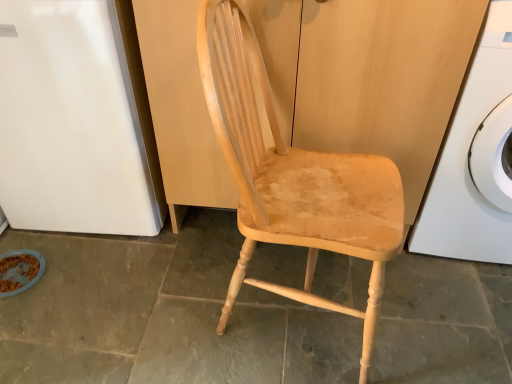
Locate an element on the screen. The width and height of the screenshot is (512, 384). white glossy washing machine at right is located at coordinates (468, 160).

Where is `brown crumbly food at lower left`? This screenshot has height=384, width=512. brown crumbly food at lower left is located at coordinates (17, 271).

What do you see at coordinates (71, 122) in the screenshot?
I see `white glossy refrigerator at left` at bounding box center [71, 122].

At what (x,y) coordinates should I click in order to perform the action: click on white glossy washing machine at right. Please return your answer as a coordinate pair (x, y). Looking at the image, I should click on (468, 160).

Consider the image. Is there a large distance between natural wood dresser at center and natural wood chair at center?

No, natural wood dresser at center is in close proximity to natural wood chair at center.

Considering the positions of objects natural wood dresser at center and natural wood chair at center in the image provided, who is in front, natural wood dresser at center or natural wood chair at center?

natural wood chair at center is closer to the camera.

Considering the relative sizes of natural wood dresser at center and natural wood chair at center in the image provided, is natural wood dresser at center taller than natural wood chair at center?

In fact, natural wood dresser at center may be shorter than natural wood chair at center.

In the scene shown: From the image's perspective, is natural wood dresser at center on natural wood chair at center?

Yes, from the image's perspective, natural wood dresser at center is on top of natural wood chair at center.

Which of these two, brown crumbly food at lower left or white glossy refrigerator at left, is thinner?

With smaller width is brown crumbly food at lower left.

Can you confirm if brown crumbly food at lower left is shorter than white glossy refrigerator at left?

Correct, brown crumbly food at lower left is not as tall as white glossy refrigerator at left.

From the image's perspective, is brown crumbly food at lower left beneath white glossy refrigerator at left?

Yes, from the image's perspective, brown crumbly food at lower left is below white glossy refrigerator at left.

Is brown crumbly food at lower left situated inside white glossy refrigerator at left or outside?

brown crumbly food at lower left is outside white glossy refrigerator at left.

Which is more to the right, white glossy washing machine at right or natural wood dresser at center?

white glossy washing machine at right is more to the right.

Is white glossy washing machine at right oriented towards natural wood dresser at center?

No, white glossy washing machine at right is not oriented towards natural wood dresser at center.

Where is `washing machine to the right of natural wood dresser at center`? This screenshot has height=384, width=512. washing machine to the right of natural wood dresser at center is located at coordinates coord(468,160).

Can you tell me how much white glossy washing machine at right and natural wood dresser at center differ in facing direction?

The facing directions of white glossy washing machine at right and natural wood dresser at center are 0.000117 degrees apart.

Considering the sizes of natural wood dresser at center and white glossy washing machine at right in the image, is natural wood dresser at center bigger or smaller than white glossy washing machine at right?

Clearly, natural wood dresser at center is larger in size than white glossy washing machine at right.

Considering the relative sizes of natural wood dresser at center and white glossy washing machine at right in the image provided, is natural wood dresser at center shorter than white glossy washing machine at right?

Yes.

Visually, is natural wood dresser at center positioned to the left or to the right of white glossy washing machine at right?

natural wood dresser at center is positioned on white glossy washing machine at right's left side.

Relative to natural wood dresser at center, is white glossy refrigerator at left in front or behind?

Clearly, white glossy refrigerator at left is behind natural wood dresser at center.

Is point (135, 132) positioned in front of point (349, 80)?

No, it is behind (349, 80).

Which of these two, white glossy refrigerator at left or natural wood dresser at center, is thinner?

natural wood dresser at center is thinner.

In the scene shown: Does white glossy refrigerator at left have a lesser height compared to natural wood dresser at center?

Yes.

Is point (212, 120) closer to camera compared to point (470, 184)?

That is True.

The height and width of the screenshot is (384, 512). In order to click on washing machine on the right side of natural wood chair at center in this screenshot , I will do `click(468, 160)`.

Is the surface of natural wood chair at center in direct contact with white glossy washing machine at right?

No, natural wood chair at center is not touching white glossy washing machine at right.

Relative to white glossy washing machine at right, is natural wood chair at center in front or behind?

natural wood chair at center is positioned closer to the viewer than white glossy washing machine at right.

Who is taller, white glossy refrigerator at left or brown crumbly food at lower left?

Standing taller between the two is white glossy refrigerator at left.

Is white glossy refrigerator at left positioned beyond the bounds of brown crumbly food at lower left?

Yes, white glossy refrigerator at left is outside of brown crumbly food at lower left.

From a real-world perspective, is white glossy refrigerator at left positioned under brown crumbly food at lower left based on gravity?

No, from a real-world perspective, white glossy refrigerator at left is not beneath brown crumbly food at lower left.

At what (x,y) coordinates should I click in order to perform the action: click on dresser on the right of natural wood chair at center. Please return your answer as a coordinate pair (x, y). The height and width of the screenshot is (384, 512). Looking at the image, I should click on (396, 79).

Where is `food that is below the white glossy refrigerator at left (from the image's perspective)`? Image resolution: width=512 pixels, height=384 pixels. food that is below the white glossy refrigerator at left (from the image's perspective) is located at coordinates (17, 271).

From the image, which object appears to be nearer to white glossy washing machine at right, natural wood dresser at center or natural wood chair at center?

Based on the image, natural wood dresser at center appears to be nearer to white glossy washing machine at right.

From the image, which object appears to be nearer to brown crumbly food at lower left, natural wood dresser at center or natural wood chair at center?

Based on the image, natural wood chair at center appears to be nearer to brown crumbly food at lower left.

Considering their positions, is white glossy washing machine at right positioned further to brown crumbly food at lower left than natural wood chair at center?

Among the two, white glossy washing machine at right is located further to brown crumbly food at lower left.

Which object lies further to the anchor point natural wood chair at center, natural wood dresser at center or white glossy refrigerator at left?

Based on the image, white glossy refrigerator at left appears to be further to natural wood chair at center.

Estimate the real-world distances between objects in this image. Which object is closer to white glossy washing machine at right, white glossy refrigerator at left or natural wood dresser at center?

The object closer to white glossy washing machine at right is natural wood dresser at center.

Looking at the image, which one is located further to white glossy refrigerator at left, natural wood chair at center or brown crumbly food at lower left?

natural wood chair at center.

Based on their spatial positions, is white glossy washing machine at right or natural wood dresser at center closer to white glossy refrigerator at left?

natural wood dresser at center lies closer to white glossy refrigerator at left than the other object.

Based on their spatial positions, is white glossy washing machine at right or natural wood chair at center further from white glossy refrigerator at left?

Among the two, white glossy washing machine at right is located further to white glossy refrigerator at left.

Find the location of a particular element. The height and width of the screenshot is (384, 512). chair situated between brown crumbly food at lower left and white glossy washing machine at right from left to right is located at coordinates (293, 177).

Locate an element on the screen. chair between white glossy refrigerator at left and white glossy washing machine at right in the horizontal direction is located at coordinates (293, 177).

Image resolution: width=512 pixels, height=384 pixels. I want to click on leftover between brown crumbly food at lower left and natural wood chair at center, so click(71, 122).

The height and width of the screenshot is (384, 512). Identify the location of leftover between brown crumbly food at lower left and white glossy washing machine at right. (71, 122).